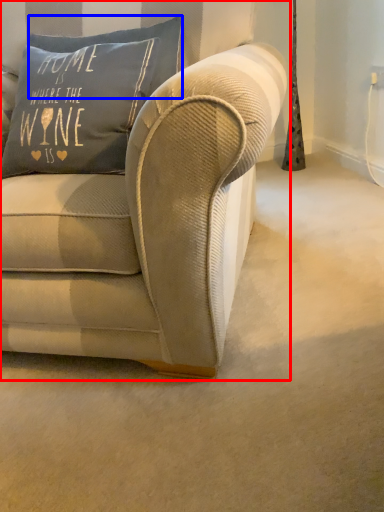
Question: Which point is closer to the camera, studio couch (highlighted by a red box) or pillow (highlighted by a blue box)?

Choices:
 (A) studio couch
 (B) pillow

Answer: (A)